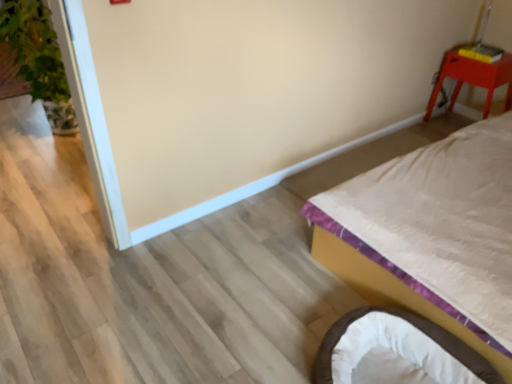
Question: Would you say white satin bed at right is inside or outside matte red stool at upper right?

Choices:
 (A) inside
 (B) outside

Answer: (B)

Question: Considering the positions of point (x=324, y=244) and point (x=461, y=71), is point (x=324, y=244) closer or farther from the camera than point (x=461, y=71)?

Choices:
 (A) farther
 (B) closer

Answer: (B)

Question: Which object is positioned closest to the green leafy plant at left?

Choices:
 (A) matte red stool at upper right
 (B) soft white fabric infant bed at lower right
 (C) white satin bed at right

Answer: (C)

Question: Which of these objects is positioned farthest from the matte red stool at upper right?

Choices:
 (A) soft white fabric infant bed at lower right
 (B) green leafy plant at left
 (C) white satin bed at right

Answer: (B)